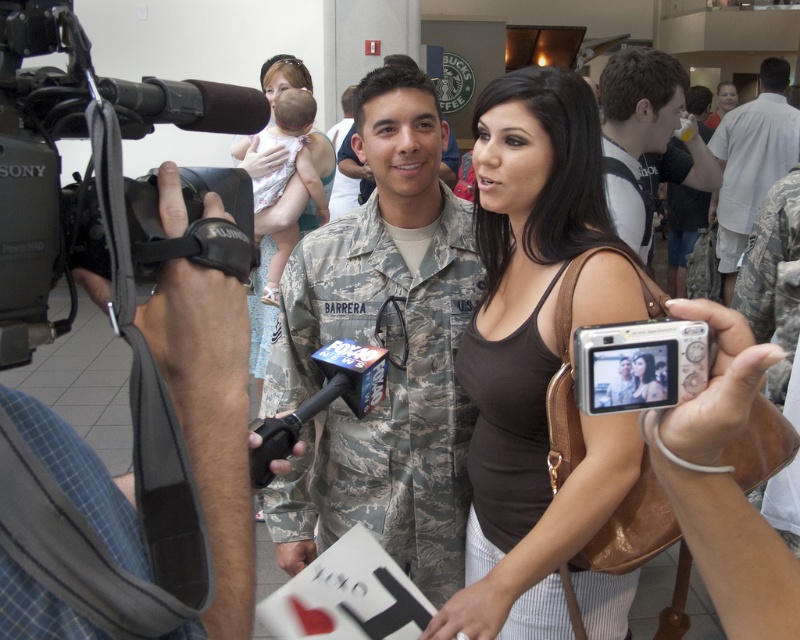
This screenshot has width=800, height=640. What do you see at coordinates (536, 355) in the screenshot? I see `brown fabric tank top at center` at bounding box center [536, 355].

Does brown fabric tank top at center have a smaller size compared to black matte video camera at left?

No, brown fabric tank top at center is not smaller than black matte video camera at left.

Is point (548, 81) closer to viewer compared to point (136, 180)?

No, (548, 81) is behind (136, 180).

I want to click on brown fabric tank top at center, so click(x=536, y=355).

Who is positioned more to the left, camouflage fabric uniform at center or white mesh shirt at upper right?

From the viewer's perspective, camouflage fabric uniform at center appears more on the left side.

How distant is camouflage fabric uniform at center from white mesh shirt at upper right?

camouflage fabric uniform at center is 35.02 inches from white mesh shirt at upper right.

Who is more distant from viewer, (454,508) or (642,246)?

The point (642,246) is more distant.

You are a GUI agent. You are given a task and a screenshot of the screen. Output one action in this format:
    pyautogui.click(x=<x>, y=<y>)
    Task: Click on the camouflage fabric uniform at center
    
    Given the screenshot: What is the action you would take?
    pyautogui.click(x=385, y=394)

Looking at this image, is black matte video camera at left positioned at the back of white cotton shirt at center?

That is False.

At what (x,y) coordinates should I click in order to perform the action: click on black matte video camera at left. Please return your answer as a coordinate pair (x, y). The image size is (800, 640). Looking at the image, I should click on (60, 157).

I want to click on black matte video camera at left, so click(x=60, y=157).